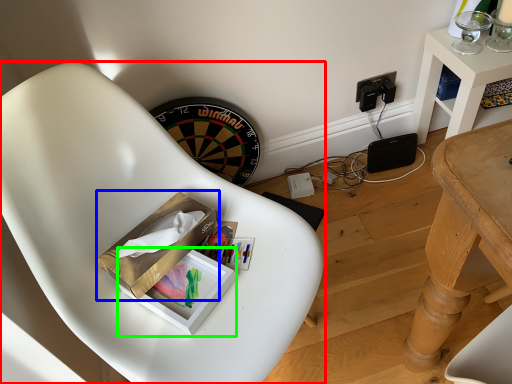
Question: Which object is positioned farthest from chair (highlighted by a red box)? Select from cardboard box (highlighted by a blue box) and box (highlighted by a green box).

Choices:
 (A) cardboard box
 (B) box

Answer: (B)